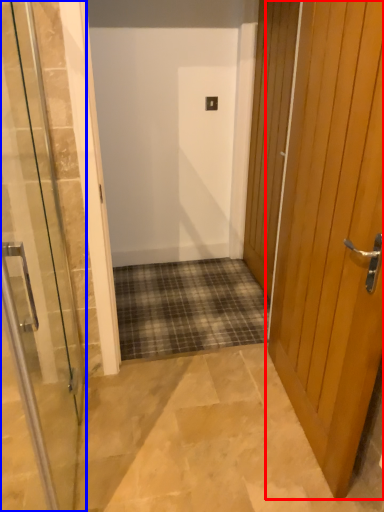
Question: Among these objects, which one is nearest to the camera, door (highlighted by a red box) or door (highlighted by a blue box)?

Choices:
 (A) door
 (B) door

Answer: (B)